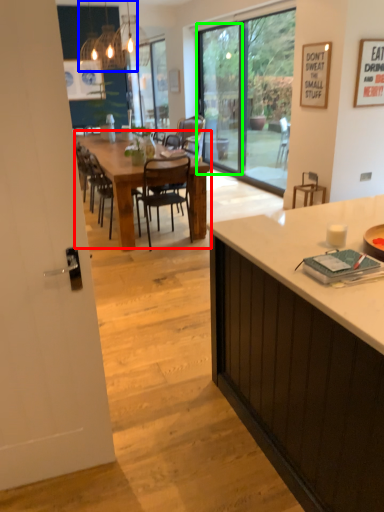
Question: Which is nearer to the kitchen & dining room table (highlighted by a red box)? light fixture (highlighted by a blue box) or screen door (highlighted by a green box).

Choices:
 (A) light fixture
 (B) screen door

Answer: (B)